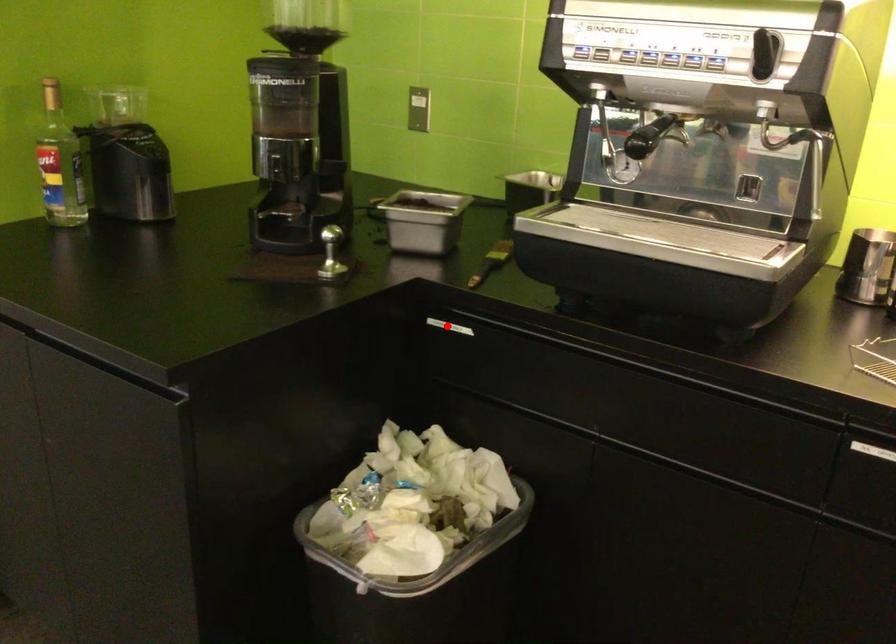
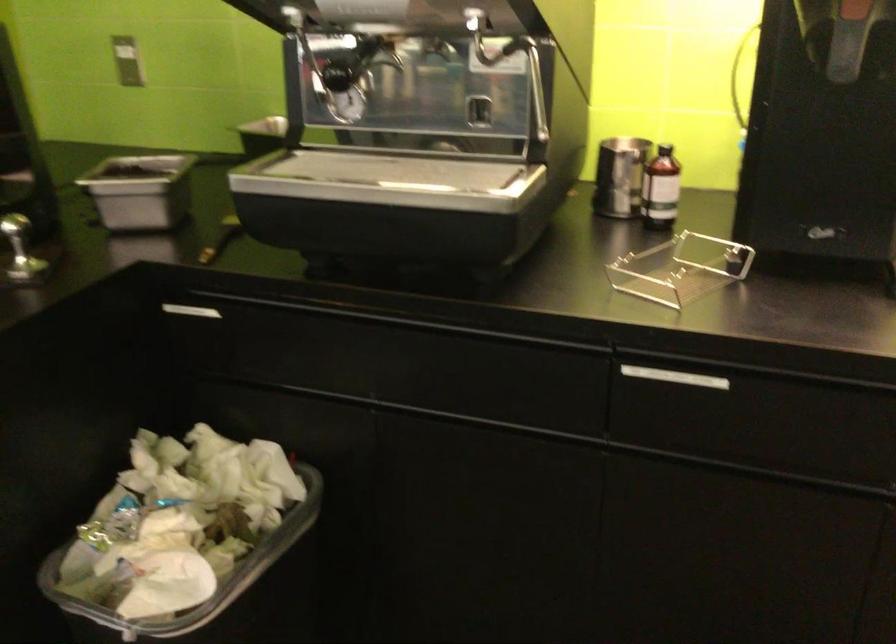
Question: I am providing you with two images of the same scene from different viewpoints. In image1, a red point is highlighted. Considering the same 3D point in image2, which of the following is correct?

Choices:
 (A) It is closer
 (B) It is farther

Answer: (A)